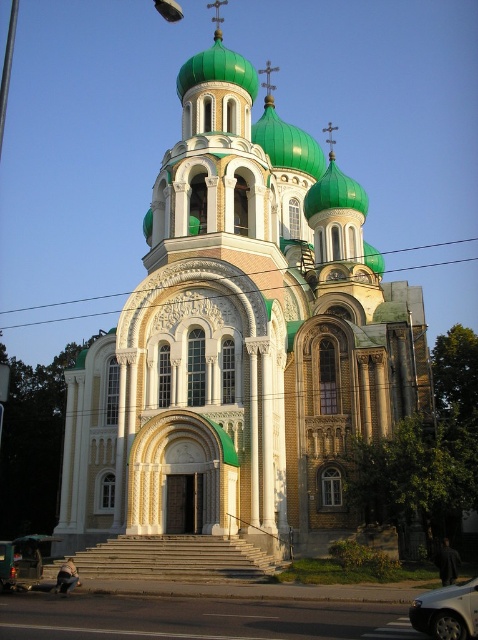
You are a photographer planning to capture the white stone church at center and the white glossy car at lower right in a single shot. Based on their sizes, which object should appear larger in your photo?

The white stone church at center should appear larger in the photo since it is taller than the white glossy car at lower right.

You are a photographer standing at the entrance of the white stone church at center. You want to take a photo of the church without the white glossy car at lower right appearing in the shot. Is it possible to do so by adjusting your position or angle?

The white stone church at center is positioned over the white glossy car at lower right, so if you move to a higher vantage point or angle your camera upwards, you can capture the church without the car obstructing the view.